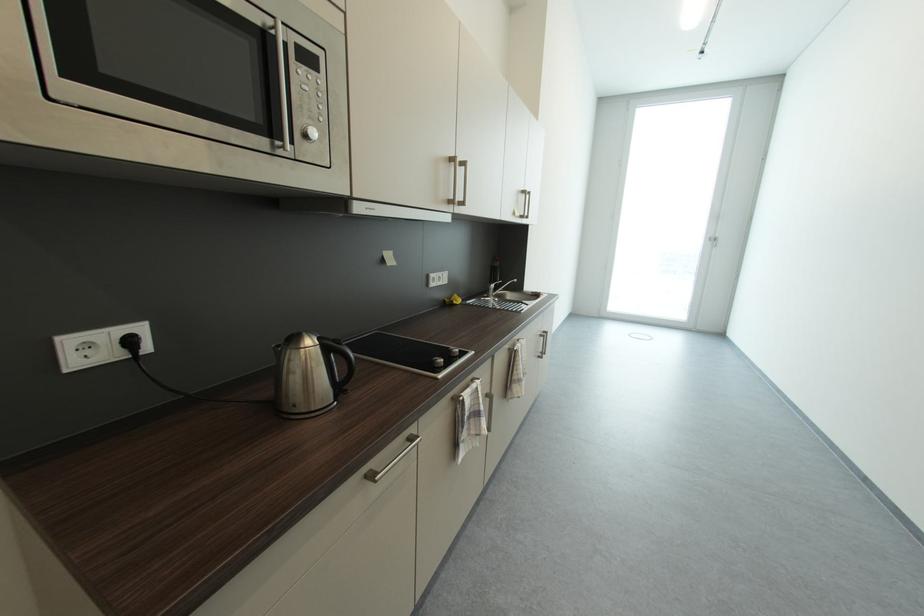
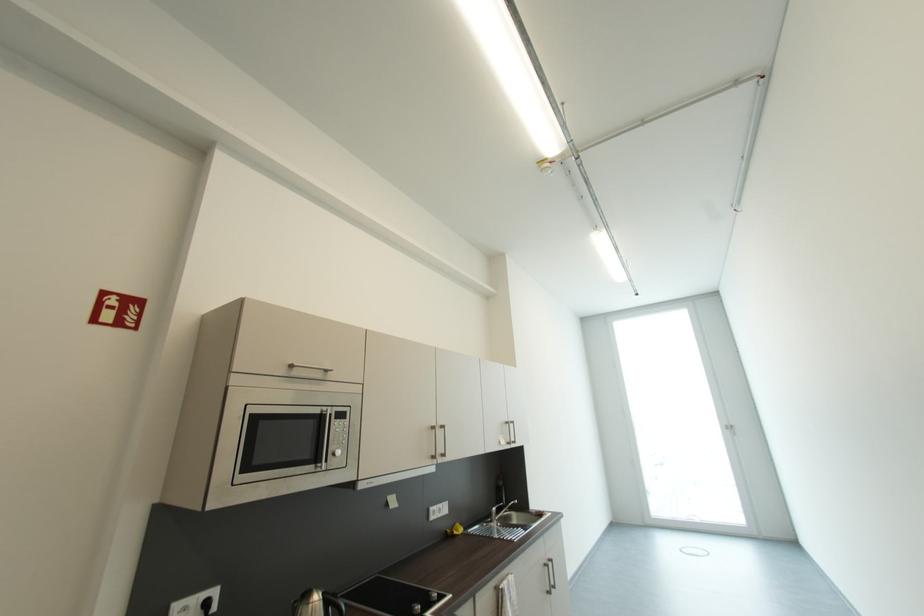
The point at (309, 352) is marked in the first image. Where is the corresponding point in the second image?

(317, 607)